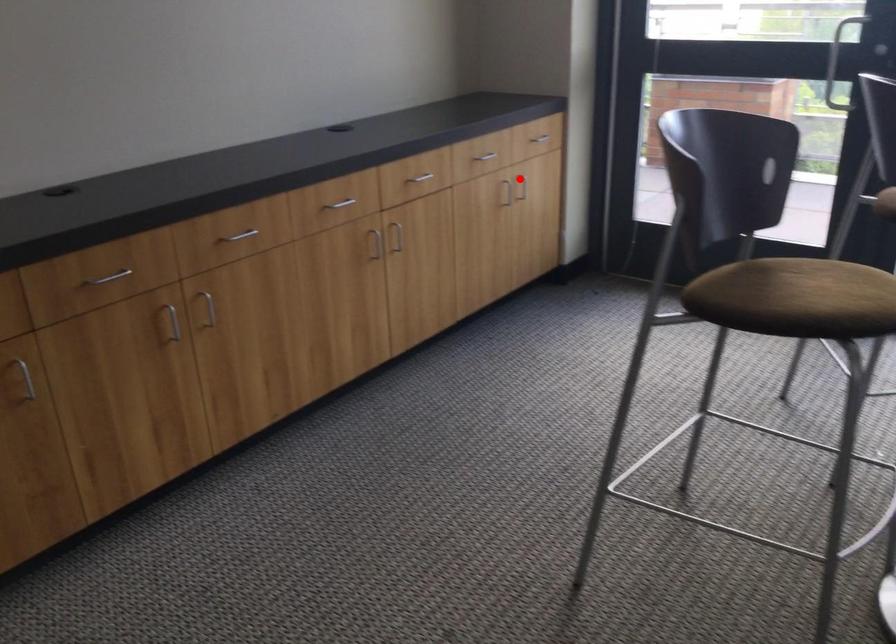
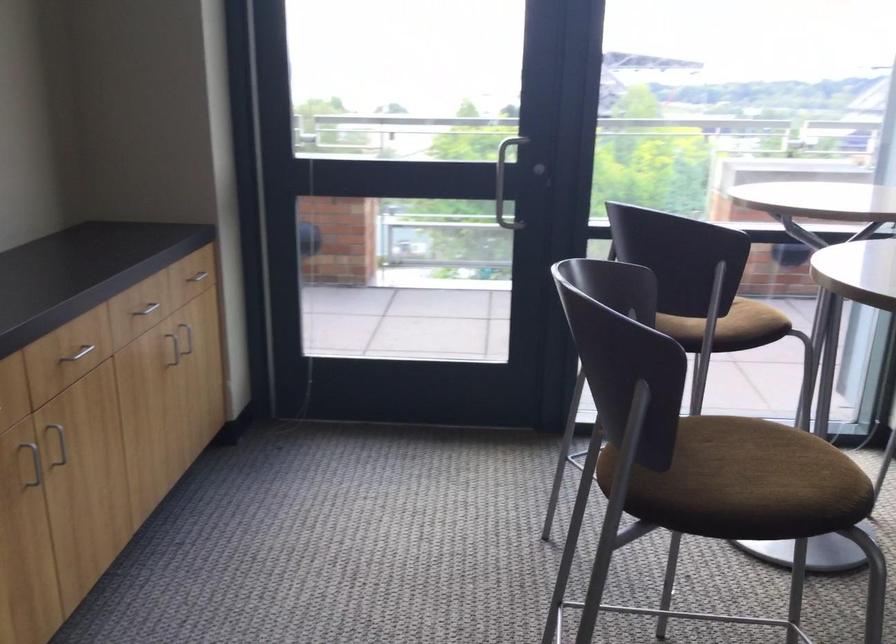
Find the pixel in the second image that matches the highlighted location in the first image.

(188, 337)